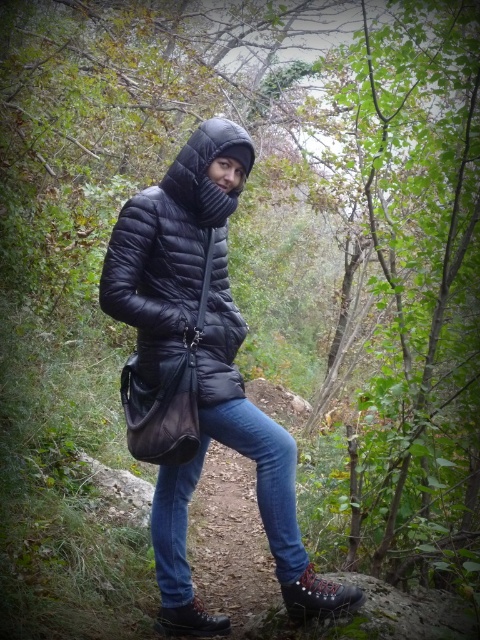
Which is in front, point (193, 289) or point (156, 388)?

Positioned in front is point (156, 388).

Can you confirm if matte black jacket at center is positioned above matte black puffer jacket at center?

Actually, matte black jacket at center is below matte black puffer jacket at center.

This screenshot has width=480, height=640. What do you see at coordinates (200, 372) in the screenshot? I see `matte black jacket at center` at bounding box center [200, 372].

The image size is (480, 640). In order to click on matte black jacket at center in this screenshot , I will do `click(200, 372)`.

Does point (179, 554) come farther from viewer compared to point (199, 145)?

Yes, it is.

Is point (196, 460) positioned behind point (213, 193)?

Yes, point (196, 460) is farther from viewer.

Find the location of a particular element. blue denim jeans at center is located at coordinates (255, 490).

Who is positioned more to the left, matte black jacket at center or black quilted hood at center?

Positioned to the left is black quilted hood at center.

Is point (182, 387) behind point (233, 140)?

No.

Where is `matte black jacket at center`? The image size is (480, 640). matte black jacket at center is located at coordinates (200, 372).